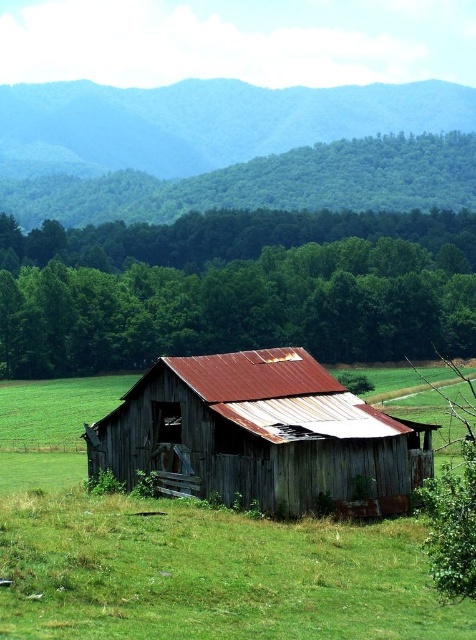
You are standing in the field looking at the scene. Which object is positioned to the right side when comparing the rusty metal barn at center and the green forested hillside at upper left?

The rusty metal barn at center is positioned to the right of the green forested hillside at upper left.

You are standing in a field and see the rusty metal barn at center and the green forested hillside at upper left. Which of these two objects is closer to you?

The rusty metal barn at center is closer to you because it is smaller in size compared to the green forested hillside at upper left, which is farther away.

You are standing in the field in front of the image. Which object, the rusty metal barn at center or the green forested hillside at upper left, is closer to you?

The rusty metal barn at center is closer to you because it is positioned in front of the green forested hillside at upper left.